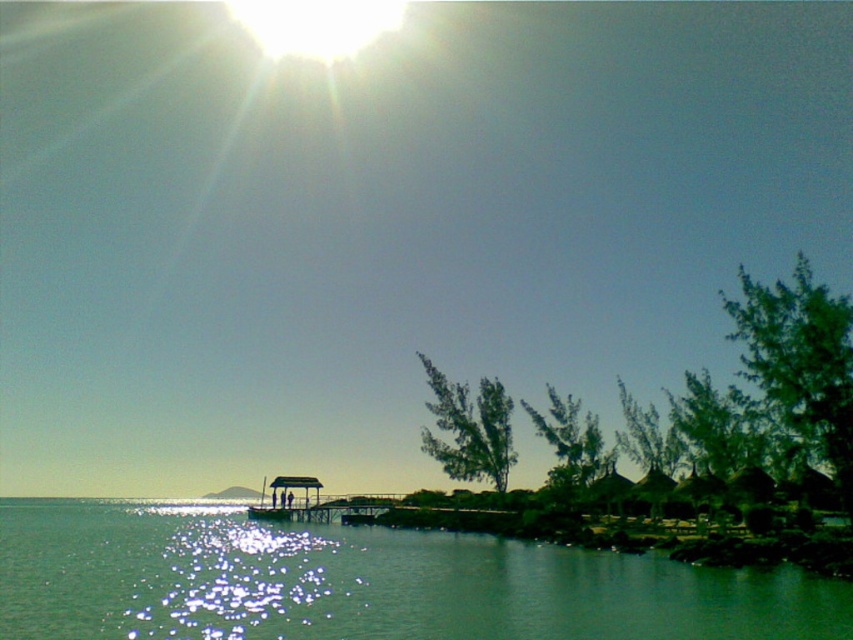
Between green glossy water at center and wooden pier at center, which one is positioned higher?

green glossy water at center is above.

You are a GUI agent. You are given a task and a screenshot of the screen. Output one action in this format:
    pyautogui.click(x=<x>, y=<y>)
    Task: Click on the green glossy water at center
    This screenshot has height=640, width=853.
    Given the screenshot: What is the action you would take?
    pyautogui.click(x=367, y=582)